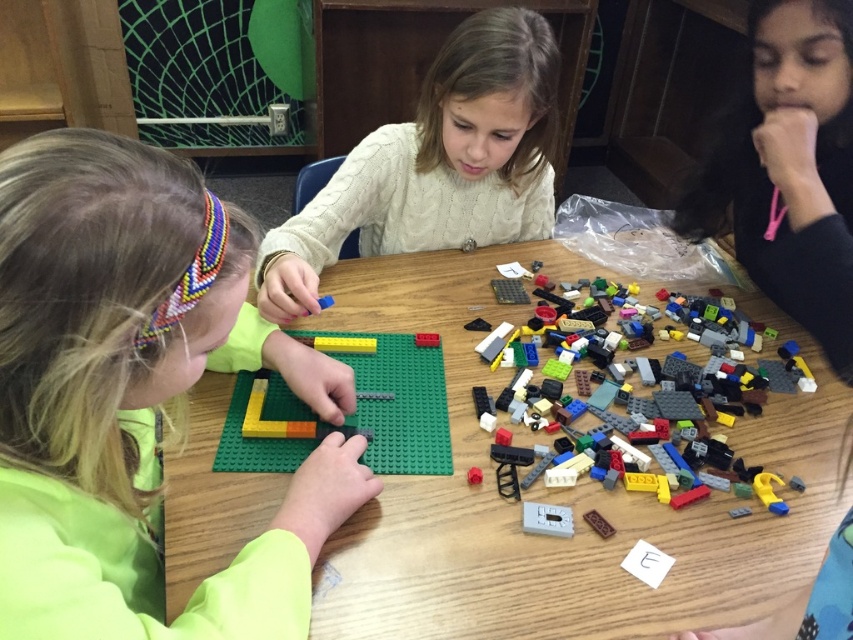
You are standing in front of the LEGO building activity area. Where exactly is the wooden table at center located in terms of coordinates?

The wooden table at center is located at coordinates point (560,493).